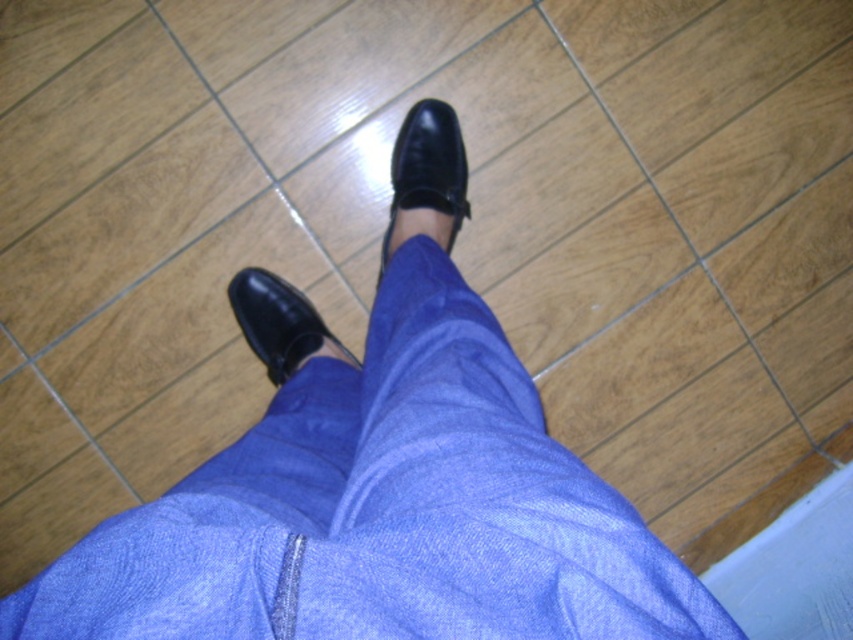
You are a photographer setting up a shoot in this scene. You need to place a small prop between the shiny black shoe at center and the black leather shoe at lower center. Based on their positions, which shoe should the prop be closer to?

The shiny black shoe at center is to the right of the black leather shoe at lower center, so the prop should be placed closer to the black leather shoe at lower center since it is positioned to the left.

You are a photographer setting up a shoot in this scene. You want to ensure that both the denim pants at center and the shiny black shoe at center are clearly visible in the photo. Based on their positions, which object should you focus on first to ensure sharpness?

The denim pants at center is below the shiny black shoe at center, so focusing on the shiny black shoe at center first will ensure both are in focus since it is closer to the camera.

You are a cleaning robot with a circular base of radius 0.15 units. You need to move from the edge of the image to the shiny black shoe at center located at point (428,166). Is there enough space for you to navigate directly to the shoe without touching it?

The shiny black shoe at center is located at point (428,166). Since the robot has a radius of 0.15 units, it needs a clear path within a radius of 0.15 units around the shoe. However, the exact spatial relationship between the robot and the shoe isn not provided in the object descriptions. Therefore, it is uncertain if there is sufficient space to navigate without touching the shoe.